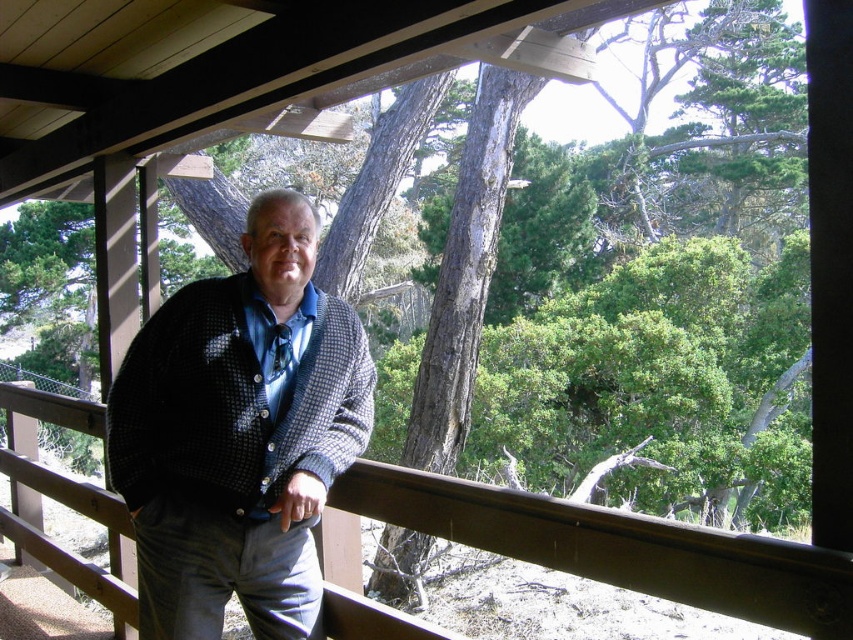
The width and height of the screenshot is (853, 640). What are the coordinates of `knitted sweater at center` in the screenshot? It's located at (239, 435).

Which of these two, knitted sweater at center or brown wooden rail at center, stands shorter?

brown wooden rail at center

What do you see at coordinates (239, 435) in the screenshot? I see `knitted sweater at center` at bounding box center [239, 435].

Where is `knitted sweater at center`? The image size is (853, 640). knitted sweater at center is located at coordinates (239, 435).